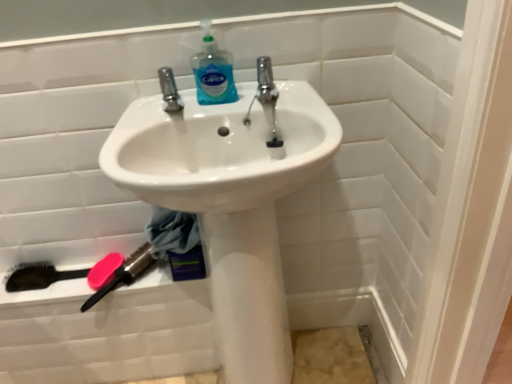
Locate an element on the screen. free spot to the right of blue translucent liquid at upper center is located at coordinates (279, 90).